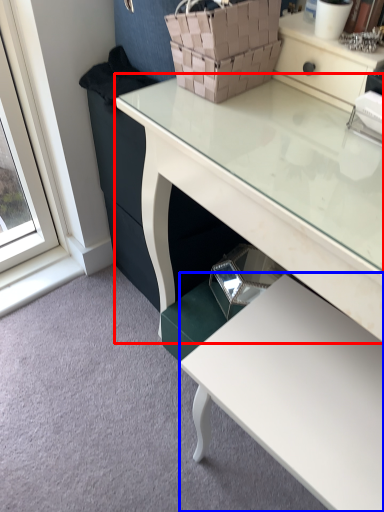
Question: Which object appears farthest to the camera in this image, desk (highlighted by a red box) or table (highlighted by a blue box)?

Choices:
 (A) desk
 (B) table

Answer: (B)